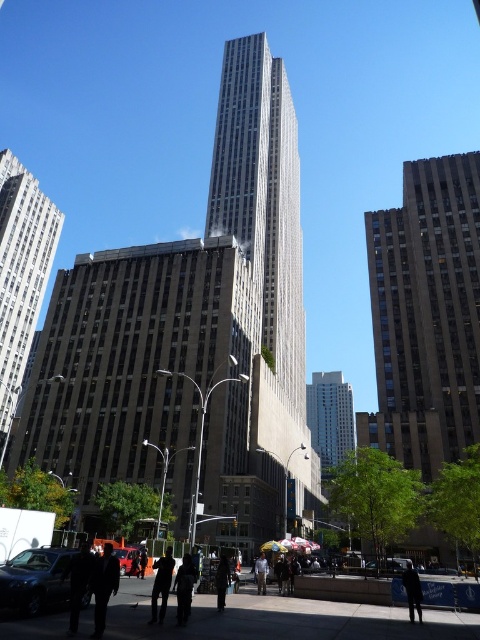
Who is shorter, brown stone building at right or dark brown leather jacket at center?

Standing shorter between the two is dark brown leather jacket at center.

Which is in front, point (431, 371) or point (217, 577)?

Positioned in front is point (217, 577).

Locate an element on the screen. brown stone building at right is located at coordinates (425, 316).

Can you confirm if gray stone skyscraper at left is positioned above shiny red car at center?

Yes, gray stone skyscraper at left is above shiny red car at center.

Can you confirm if gray stone skyscraper at left is smaller than shiny red car at center?

Actually, gray stone skyscraper at left might be larger than shiny red car at center.

Is point (37, 209) positioned before point (132, 554)?

No.

The height and width of the screenshot is (640, 480). Identify the location of gray stone skyscraper at left. (21, 272).

Is point (424, 397) farther from camera compared to point (1, 371)?

No, (424, 397) is in front of (1, 371).

Can you confirm if brown stone building at right is positioned above gray stone skyscraper at left?

Actually, brown stone building at right is below gray stone skyscraper at left.

Is point (453, 417) positioned behind point (7, 305)?

No, (453, 417) is in front of (7, 305).

Image resolution: width=480 pixels, height=640 pixels. I want to click on brown stone building at right, so click(x=425, y=316).